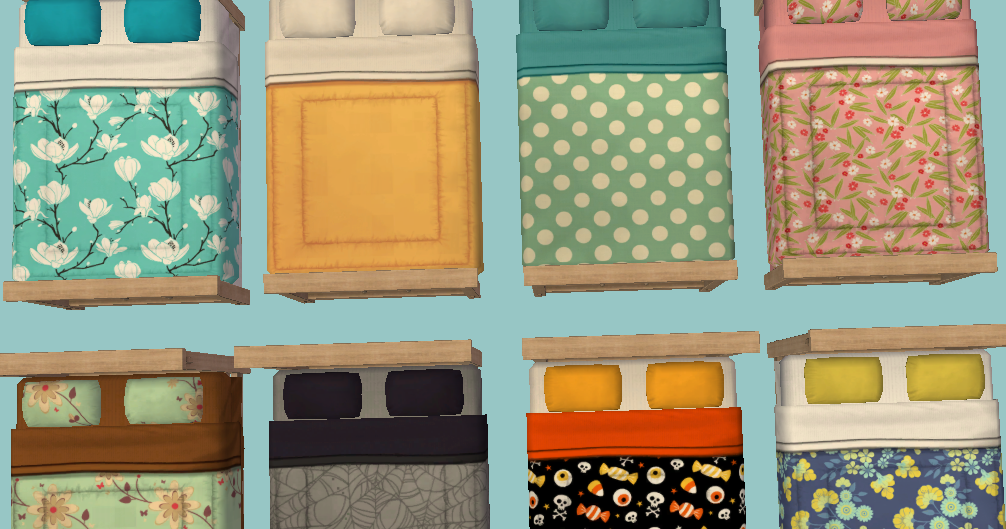
This screenshot has height=529, width=1006. Identify the location of flower comforters. [888, 500], [106, 174], [874, 145], [114, 501].